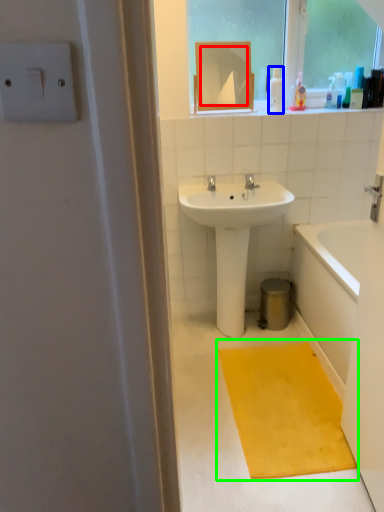
Question: Which is nearer to the mirror (highlighted by a red box)? toiletry (highlighted by a blue box) or doormat (highlighted by a green box).

Choices:
 (A) toiletry
 (B) doormat

Answer: (A)